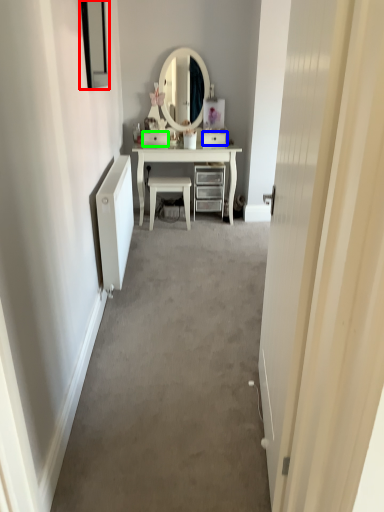
Question: Considering the real-world distances, which object is closest to picture frame (highlighted by a red box)? drawer (highlighted by a blue box) or drawer (highlighted by a green box).

Choices:
 (A) drawer
 (B) drawer

Answer: (B)